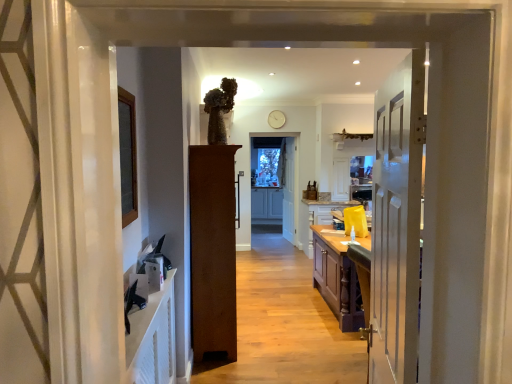
Question: Considering the relative sizes of matte gray cabinetry at center, acting as the second cabinetry starting from the front, and white painted wood door at right, which ranks as the 2th door in right-to-left order, in the image provided, is matte gray cabinetry at center, acting as the second cabinetry starting from the front, shorter than white painted wood door at right, which ranks as the 2th door in right-to-left order,?

Choices:
 (A) no
 (B) yes

Answer: (B)

Question: Does matte gray cabinetry at center, acting as the second cabinetry starting from the front, have a lesser width compared to white painted wood door at right, which appears as the 1th door when viewed from the front?

Choices:
 (A) no
 (B) yes

Answer: (A)

Question: From the image's perspective, does matte gray cabinetry at center, which is counted as the first cabinetry, starting from the left, appear lower than white painted wood door at right, which appears as the 1th door when viewed from the front?

Choices:
 (A) no
 (B) yes

Answer: (B)

Question: Does matte gray cabinetry at center, acting as the 1th cabinetry starting from the back, lie in front of white painted wood door at right, which ranks as the 2th door in right-to-left order?

Choices:
 (A) yes
 (B) no

Answer: (B)

Question: Is matte gray cabinetry at center, acting as the 1th cabinetry starting from the back, smaller than white painted wood door at right, which is counted as the third door, starting from the back?

Choices:
 (A) no
 (B) yes

Answer: (A)

Question: Is white wooden door at center, positioned as the third door in front-to-back order, spatially inside yellow matte cabinet at center, the first cabinetry viewed from the right, or outside of it?

Choices:
 (A) inside
 (B) outside

Answer: (B)

Question: Is white wooden door at center, the 1th door when ordered from right to left, taller or shorter than yellow matte cabinet at center, the first cabinetry viewed from the right?

Choices:
 (A) short
 (B) tall

Answer: (B)

Question: Is white wooden door at center, marked as the 1th door in a back-to-front arrangement, in front of or behind yellow matte cabinet at center, the first cabinetry viewed from the right, in the image?

Choices:
 (A) behind
 (B) front

Answer: (A)

Question: From a real-world perspective, is white wooden door at center, the third door in the left-to-right sequence, physically located above or below yellow matte cabinet at center, the first cabinetry viewed from the right?

Choices:
 (A) below
 (B) above

Answer: (B)

Question: In terms of width, does brown wood cabinet at center, which appears as the first door when viewed from the left, look wider or thinner when compared to white wooden door at center, the 1th door when ordered from right to left?

Choices:
 (A) wide
 (B) thin

Answer: (A)

Question: Is brown wood cabinet at center, which is counted as the 2th door, starting from the back, spatially inside white wooden door at center, marked as the 1th door in a back-to-front arrangement, or outside of it?

Choices:
 (A) outside
 (B) inside

Answer: (A)

Question: From a real-world perspective, is brown wood cabinet at center, the second door when ordered from front to back, above or below white wooden door at center, positioned as the third door in front-to-back order?

Choices:
 (A) below
 (B) above

Answer: (A)

Question: Is brown wood cabinet at center, which appears as the 3th door when viewed from the right, taller or shorter than white wooden door at center, the third door in the left-to-right sequence?

Choices:
 (A) tall
 (B) short

Answer: (B)

Question: From the image's perspective, is yellow matte cabinet at center, the 2th cabinetry positioned from the left, located above or below white painted wood door at right, which ranks as the 2th door in right-to-left order?

Choices:
 (A) above
 (B) below

Answer: (B)

Question: From a real-world perspective, is yellow matte cabinet at center, placed as the second cabinetry when sorted from back to front, positioned above or below white painted wood door at right, marked as the second door in a left-to-right arrangement?

Choices:
 (A) below
 (B) above

Answer: (A)